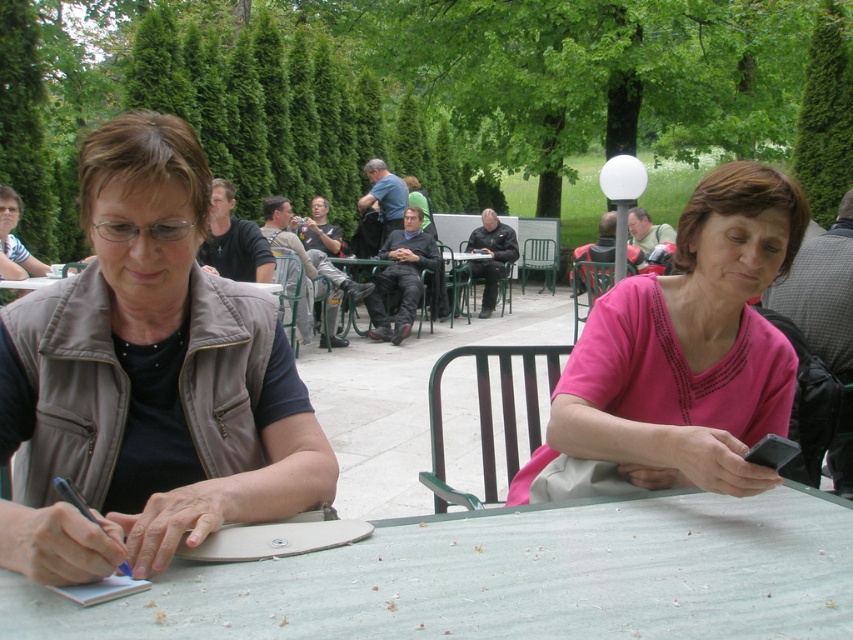
Can you confirm if light brown leather jacket at center is positioned below black leather jacket at center?

Correct, light brown leather jacket at center is located below black leather jacket at center.

Can you confirm if light brown leather jacket at center is taller than black leather jacket at center?

No.

Identify the location of light brown leather jacket at center. The width and height of the screenshot is (853, 640). (305, 248).

Can you confirm if gray checkered shirt at center is positioned to the left of leather jacket at center?

Indeed, gray checkered shirt at center is positioned on the left side of leather jacket at center.

Who is lower down, gray checkered shirt at center or leather jacket at center?

gray checkered shirt at center

Where is `gray checkered shirt at center`? gray checkered shirt at center is located at coordinates (822, 292).

Between point (583, 291) and point (363, 202), which one is positioned in front?

Point (583, 291) is more forward.

Who is more forward, (579, 284) or (376, 209)?

Point (579, 284) is more forward.

At what (x,y) coordinates should I click in order to perform the action: click on matte black jacket at center. Please return your answer as a coordinate pair (x, y). This screenshot has height=640, width=853. Looking at the image, I should click on (599, 243).